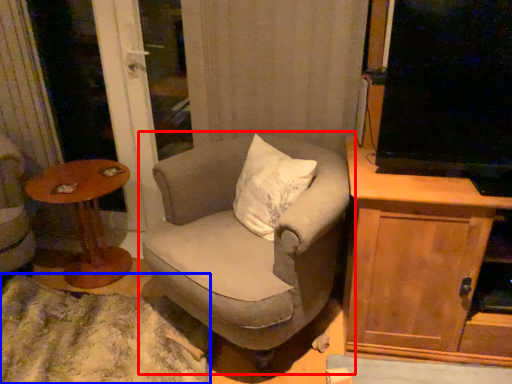
Question: Which object appears closest to the camera in this image, chair (highlighted by a red box) or plain (highlighted by a blue box)?

Choices:
 (A) chair
 (B) plain

Answer: (A)